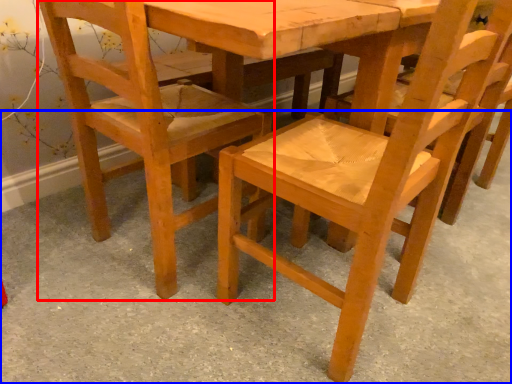
Question: Which object is further to the camera taking this photo, chair (highlighted by a red box) or concrete (highlighted by a blue box)?

Choices:
 (A) chair
 (B) concrete

Answer: (A)